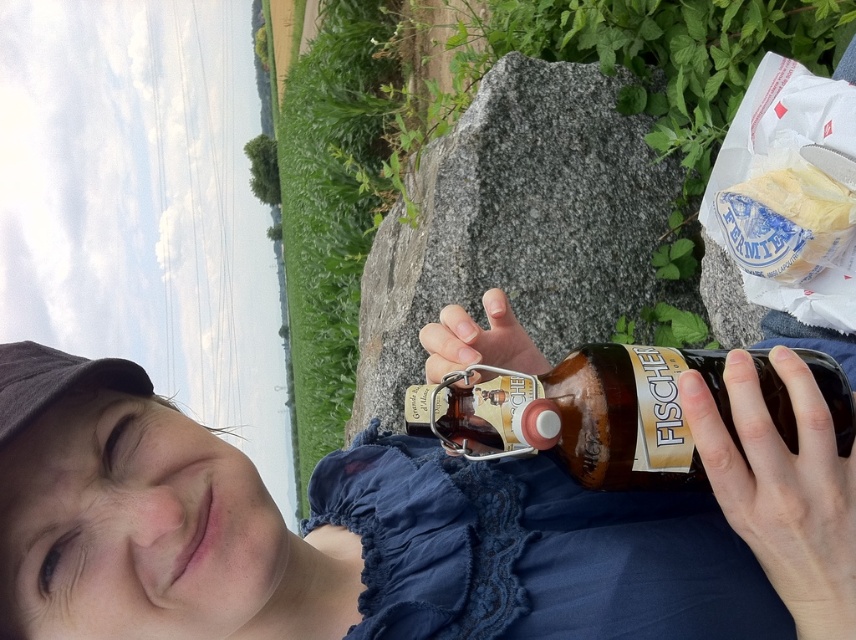
You are a photographer trying to capture the matte blue dress at lower center and the brown rock at center in the same frame. Considering their sizes, which object should you zoom in on to ensure both fit in the shot?

The matte blue dress at lower center is smaller in width than the brown rock at center. To fit both in the frame, you should zoom out slightly so that both the smaller dress and the larger rock can be captured together.